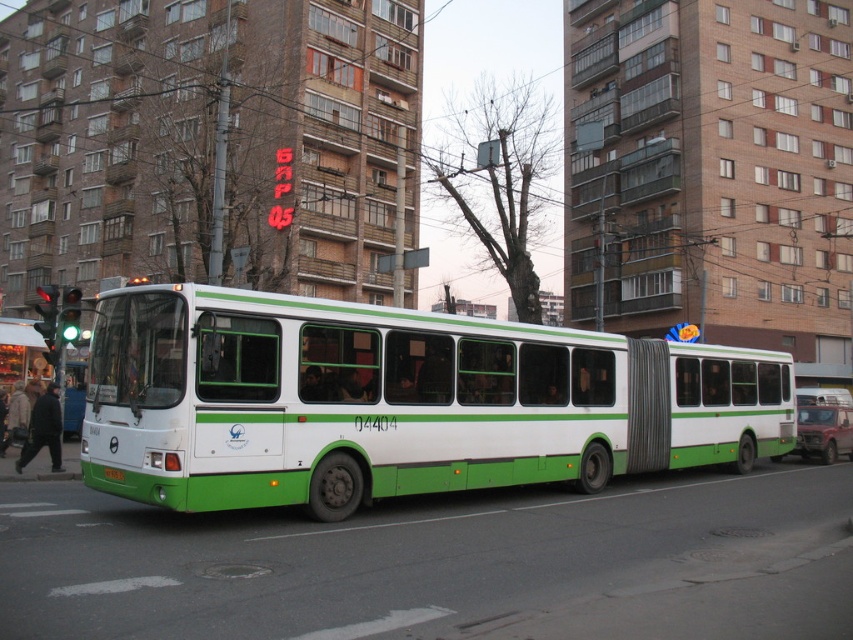
Based on the photo, you are a pedestrian waiting at the green rubber bus stop at left and want to board the green matte bus at center. Can you see the entire front of the bus from your current position?

The green matte bus at center is closer to the viewer than the green rubber bus stop at left, so you cannot see the entire front of the bus from your current position.

You are standing at the intersection and see a white and green public bus marked with the number 04404. Where is the green matte bus at center located in relation to the point with coordinates (397, 401)?

The point with coordinates (397, 401) indicates the location of the green matte bus at center.

You are a city planner reviewing the layout of this urban area. You need to ensure that the green rubber bus stop at left and the green matte license plate at center are appropriately sized for their functions. Based on their sizes, which object should be prioritized for potential resizing to improve visibility and usability?

The green rubber bus stop at left is larger in size than the green matte license plate at center. Since the bus stop requires more space for passengers to wait comfortably, it should be prioritized for resizing if needed to ensure adequate space, while the license plate, being smaller, is likely already appropriately sized.